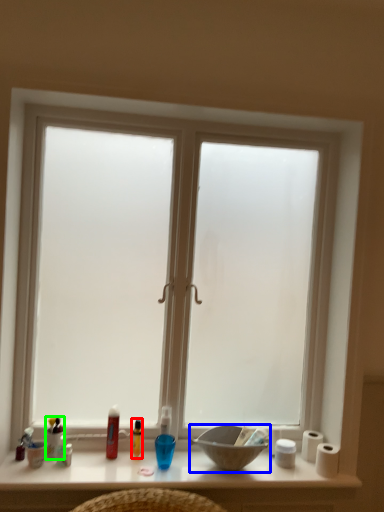
Question: Which object is positioned farthest from toiletry (highlighted by a red box)? Select from bowl (highlighted by a blue box) and toiletry (highlighted by a green box).

Choices:
 (A) bowl
 (B) toiletry

Answer: (A)